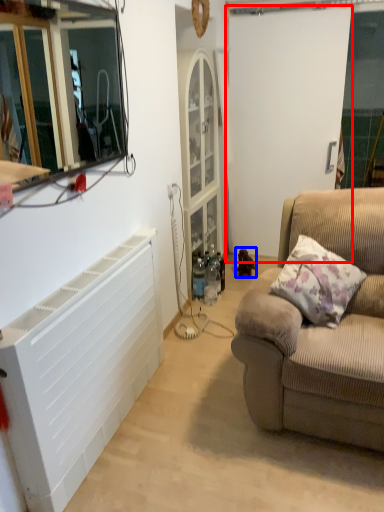
Question: Which object appears farthest to the camera in this image, screen door (highlighted by a red box) or toy (highlighted by a blue box)?

Choices:
 (A) screen door
 (B) toy

Answer: (B)